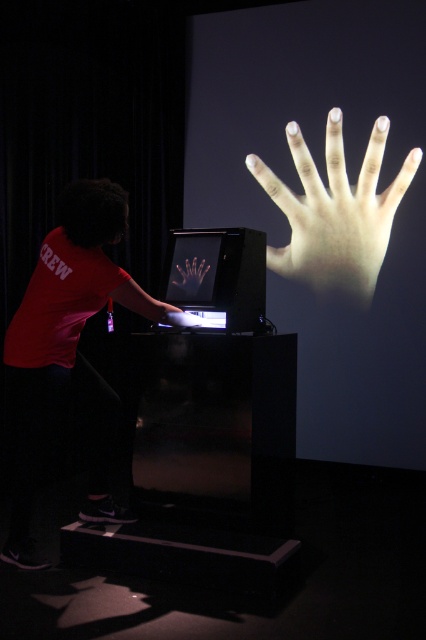
Question: Can you confirm if matte red shirt at left is positioned to the right of smooth skin hand at center?

Choices:
 (A) yes
 (B) no

Answer: (B)

Question: Which point appears closest to the camera in this image?

Choices:
 (A) (48, 392)
 (B) (284, 189)

Answer: (A)

Question: From the image, what is the correct spatial relationship of matte red shirt at left in relation to translucent plastic hand at center?

Choices:
 (A) below
 (B) above

Answer: (A)

Question: Which object is positioned farthest from the translucent plastic hand at center?

Choices:
 (A) matte red shirt at left
 (B) smooth skin hand at center

Answer: (B)

Question: Which point is farther to the camera?

Choices:
 (A) smooth skin hand at center
 (B) translucent plastic hand at center
 (C) matte red shirt at left

Answer: (A)

Question: Is smooth skin hand at center in front of translucent plastic hand at center?

Choices:
 (A) yes
 (B) no

Answer: (B)